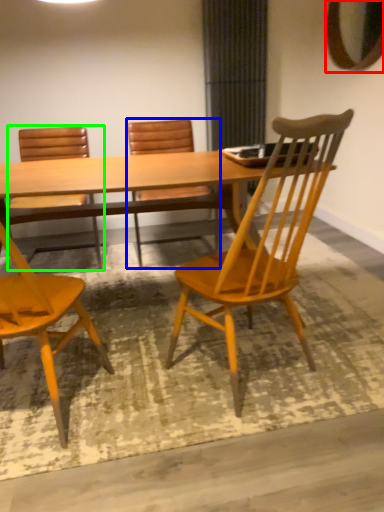
Question: Based on their relative distances, which object is farther from mirror (highlighted by a red box)? Choose from chair (highlighted by a blue box) and chair (highlighted by a green box).

Choices:
 (A) chair
 (B) chair

Answer: (B)